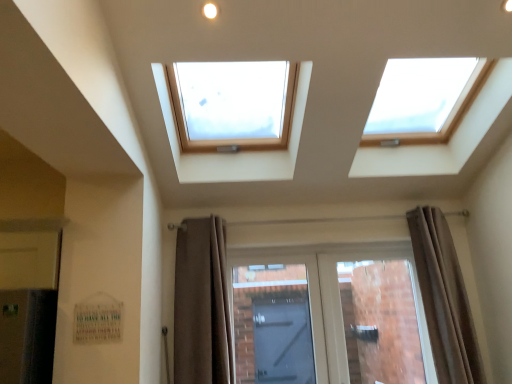
Question: In which direction should I rotate to look at brown fabric curtain at lower center, the 1th curtain from the left?

Choices:
 (A) right
 (B) left

Answer: (B)

Question: Does matte glass door at center have a larger size compared to brown fabric curtain at right, the first curtain when ordered from right to left?

Choices:
 (A) yes
 (B) no

Answer: (B)

Question: Considering the relative sizes of matte glass door at center and brown fabric curtain at right, the first curtain when ordered from right to left, in the image provided, is matte glass door at center smaller than brown fabric curtain at right, the first curtain when ordered from right to left,?

Choices:
 (A) yes
 (B) no

Answer: (A)

Question: From a real-world perspective, is matte glass door at center below brown fabric curtain at right, the first curtain when ordered from right to left?

Choices:
 (A) no
 (B) yes

Answer: (B)

Question: Is matte glass door at center facing away from brown fabric curtain at right, the second curtain from the left?

Choices:
 (A) no
 (B) yes

Answer: (A)

Question: From the image's perspective, is matte glass door at center located beneath brown fabric curtain at right, the second curtain from the left?

Choices:
 (A) no
 (B) yes

Answer: (B)

Question: Can you confirm if matte glass door at center is wider than brown fabric curtain at right, the first curtain when ordered from right to left?

Choices:
 (A) no
 (B) yes

Answer: (A)

Question: Is matte glass door at center touching brown fabric curtain at lower center, acting as the 2th curtain starting from the right?

Choices:
 (A) yes
 (B) no

Answer: (B)

Question: Considering the relative sizes of matte glass door at center and brown fabric curtain at lower center, the 1th curtain from the left, in the image provided, is matte glass door at center wider than brown fabric curtain at lower center, the 1th curtain from the left,?

Choices:
 (A) no
 (B) yes

Answer: (A)

Question: Is matte glass door at center completely or partially outside of brown fabric curtain at lower center, the 1th curtain from the left?

Choices:
 (A) no
 (B) yes

Answer: (B)

Question: Does matte glass door at center have a greater height compared to brown fabric curtain at lower center, acting as the 2th curtain starting from the right?

Choices:
 (A) no
 (B) yes

Answer: (A)

Question: Would you consider matte glass door at center to be distant from brown fabric curtain at lower center, the 1th curtain from the left?

Choices:
 (A) no
 (B) yes

Answer: (A)

Question: Is matte glass door at center to the right of brown fabric curtain at lower center, acting as the 2th curtain starting from the right, from the viewer's perspective?

Choices:
 (A) no
 (B) yes

Answer: (B)

Question: Is the depth of brown fabric curtain at right, the first curtain when ordered from right to left, greater than that of brown fabric curtain at lower center, acting as the 2th curtain starting from the right?

Choices:
 (A) yes
 (B) no

Answer: (A)